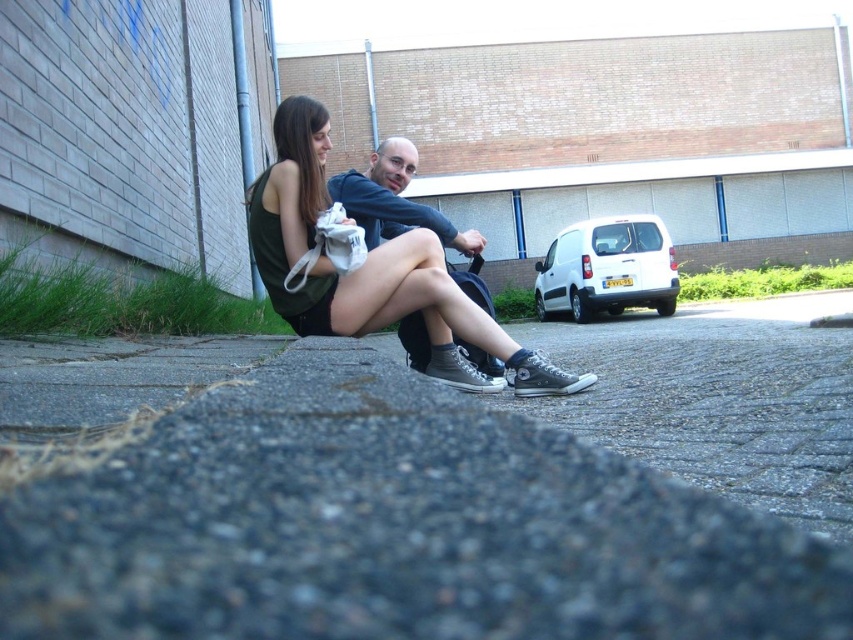
You are a delivery person trying to park your white matte van at upper right on the gray asphalt at center. Is the parking spot large enough for the van?

The gray asphalt at center is positioned under white matte van at upper right, but the description does not provide information about the size of the parking spot or the van. Therefore, it is unclear if the parking spot is large enough for the van.

You are a pedestrian trying to cross the street safely. You see the gray asphalt at center and the white matte van at upper right. Which direction should you walk to avoid the van?

You should walk to the left side of the gray asphalt at center since it is to the left of the white matte van at upper right, placing you away from the van.

You are standing in an urban area and see the gray asphalt at center and the matte black sneakers at center. Which object is nearer to you?

The gray asphalt at center is closer to the viewer than the matte black sneakers at center.